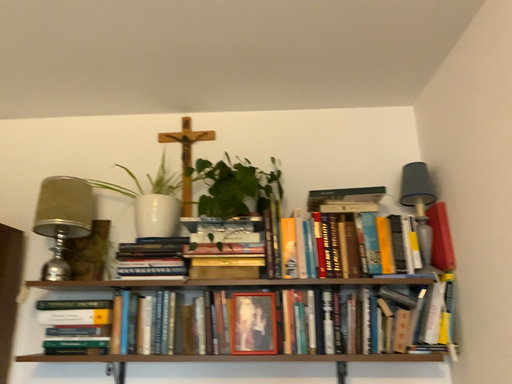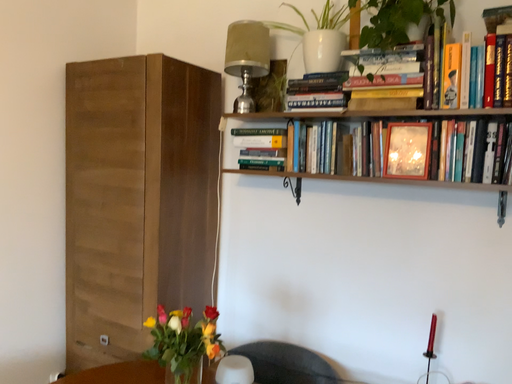
Question: Which way did the camera rotate in the video?

Choices:
 (A) rotated left
 (B) rotated right

Answer: (A)